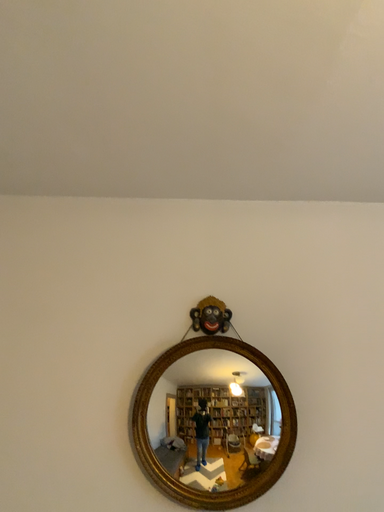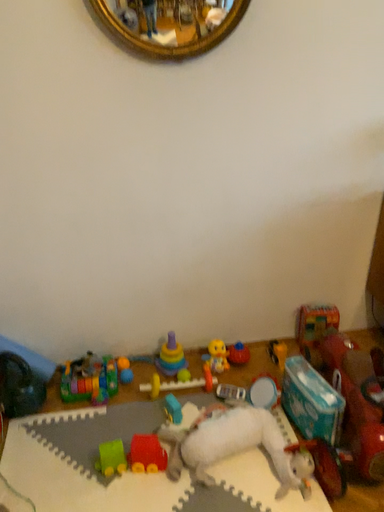
Question: How did the camera likely rotate when shooting the video?

Choices:
 (A) rotated upward
 (B) rotated downward

Answer: (B)